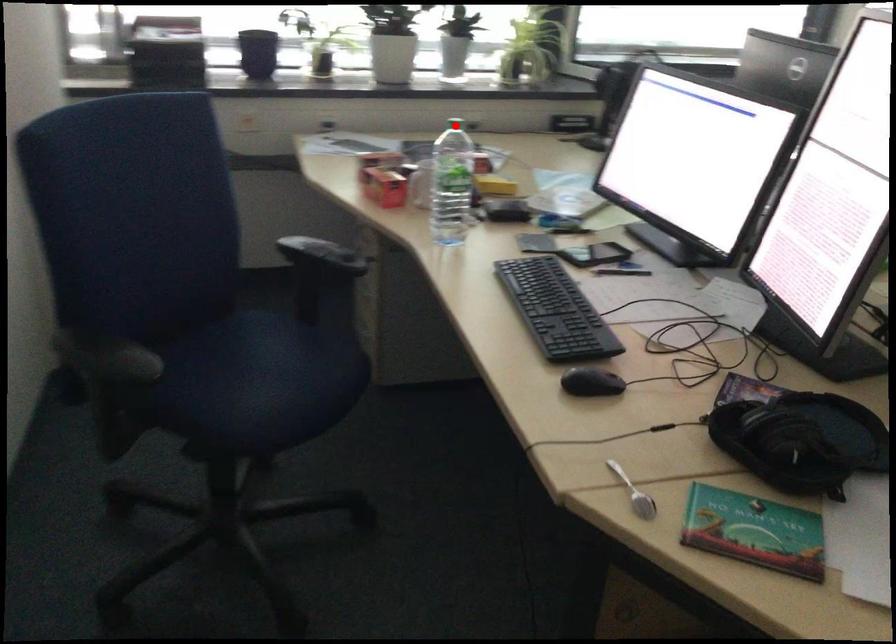
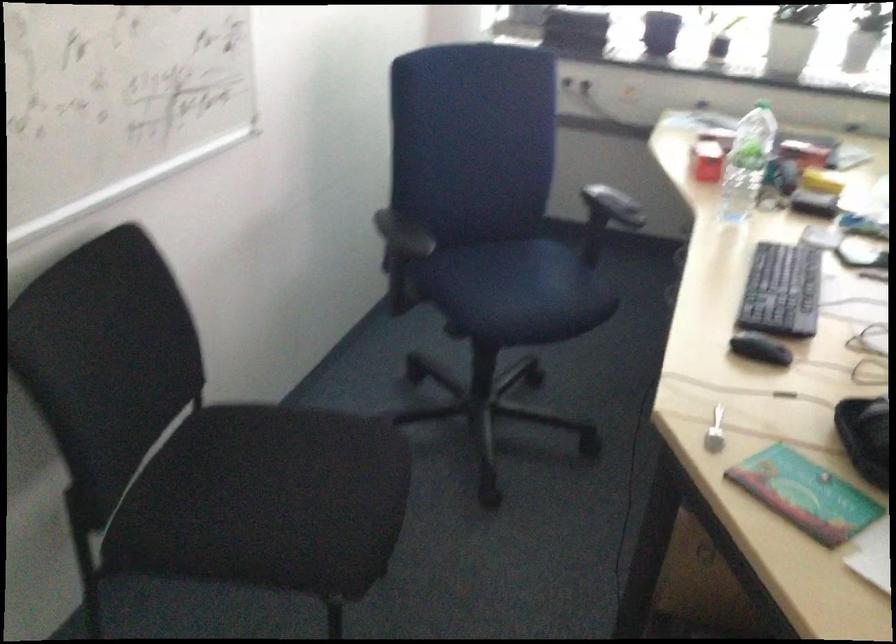
Where in the second image is the point corresponding to the highlighted location from the first image?

(763, 102)